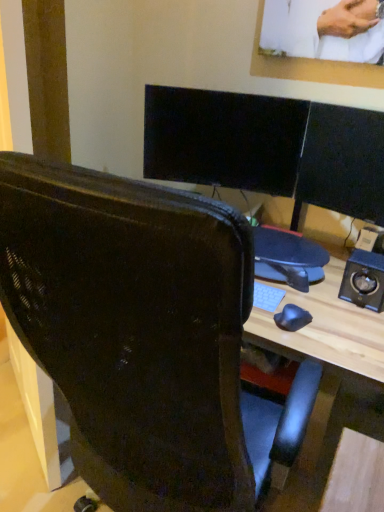
Question: In terms of width, does metallic black speaker at right look wider or thinner when compared to matte black chair at center?

Choices:
 (A) wide
 (B) thin

Answer: (B)

Question: From the image's perspective, is metallic black speaker at right located above or below matte black chair at center?

Choices:
 (A) above
 (B) below

Answer: (A)

Question: Considering the positions of metallic black speaker at right and matte black chair at center in the image, is metallic black speaker at right bigger or smaller than matte black chair at center?

Choices:
 (A) small
 (B) big

Answer: (A)

Question: Relative to metallic black speaker at right, is matte black chair at center in front or behind?

Choices:
 (A) front
 (B) behind

Answer: (A)

Question: Based on their sizes in the image, would you say matte black chair at center is bigger or smaller than metallic black speaker at right?

Choices:
 (A) big
 (B) small

Answer: (A)

Question: Is matte black chair at center taller or shorter than metallic black speaker at right?

Choices:
 (A) short
 (B) tall

Answer: (B)

Question: Is point (190, 218) positioned closer to the camera than point (377, 297)?

Choices:
 (A) farther
 (B) closer

Answer: (B)